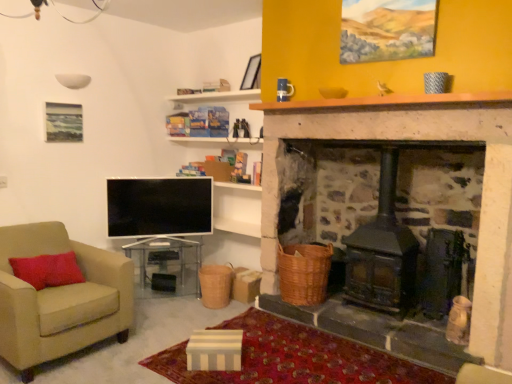
You are a GUI agent. You are given a task and a screenshot of the screen. Output one action in this format:
    pyautogui.click(x=<x>, y=<y>)
    Task: Click on the free space on the front side of braided wicker basket at center, which is counted as the second basket, starting from the right
    The height and width of the screenshot is (384, 512).
    Given the screenshot: What is the action you would take?
    pyautogui.click(x=211, y=311)